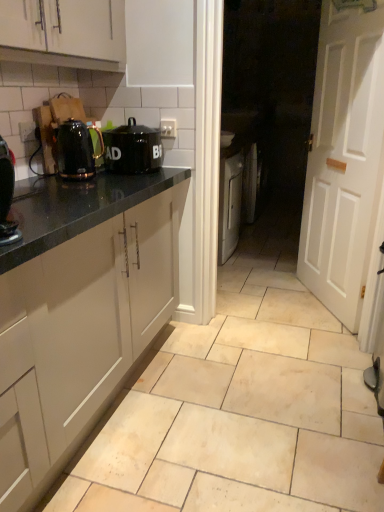
Where is `free spot above beige ceramic tile at center (from a real-world perspective)`? This screenshot has height=512, width=384. free spot above beige ceramic tile at center (from a real-world perspective) is located at coordinates (239, 398).